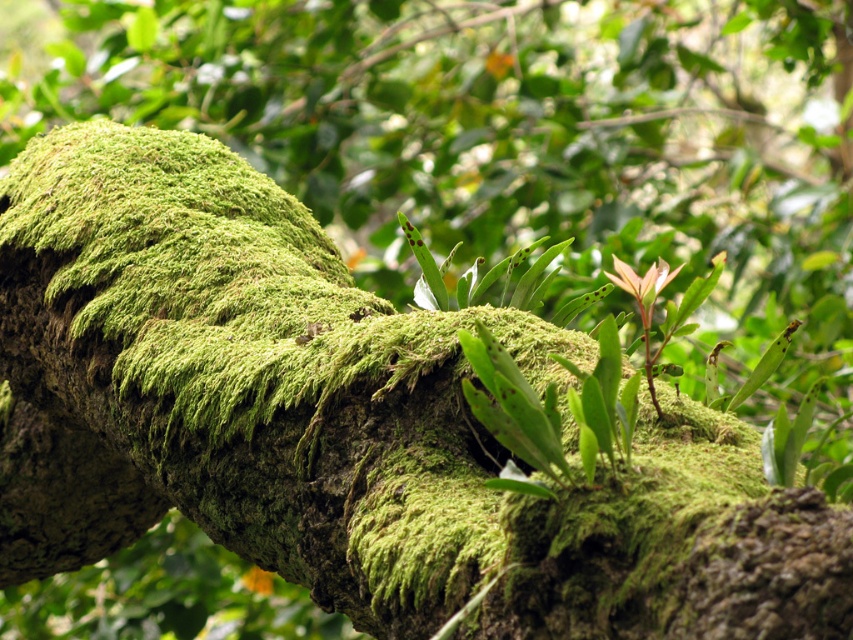
Question: Can you confirm if green leafy plant at center is positioned above green mossy branch at center?

Choices:
 (A) no
 (B) yes

Answer: (B)

Question: Can you confirm if green leafy plant at center is positioned to the left of green mossy branch at center?

Choices:
 (A) yes
 (B) no

Answer: (B)

Question: Is green leafy plant at center smaller than green mossy branch at center?

Choices:
 (A) yes
 (B) no

Answer: (A)

Question: Which object appears closest to the camera in this image?

Choices:
 (A) green mossy branch at center
 (B) green leafy plant at center

Answer: (B)